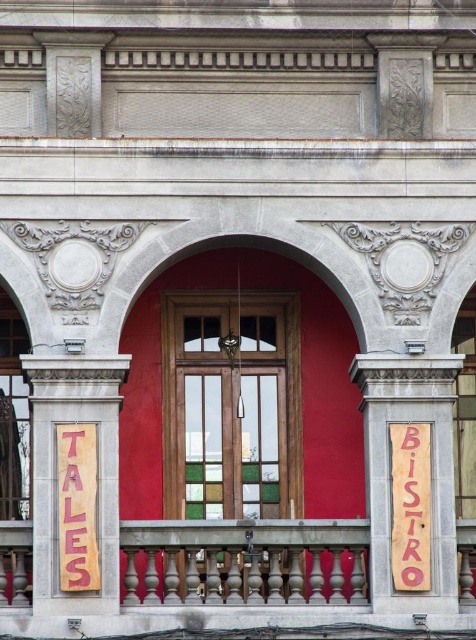
Is smooth gray balustrade at center to the left of wooden sign at center from the viewer's perspective?

Correct, you'll find smooth gray balustrade at center to the left of wooden sign at center.

Which is above, smooth gray balustrade at center or wooden sign at center?

wooden sign at center

Where is `smooth gray balustrade at center`? smooth gray balustrade at center is located at coordinates (245, 561).

Image resolution: width=476 pixels, height=640 pixels. What do you see at coordinates (245, 561) in the screenshot? I see `smooth gray balustrade at center` at bounding box center [245, 561].

Can you confirm if smooth gray balustrade at center is smaller than wooden sign at right?

No.

Is point (358, 586) less distant than point (373, 413)?

Yes.

In order to click on smooth gray balustrade at center in this screenshot , I will do `click(245, 561)`.

Can you confirm if smooth gray balustrade at center is bigger than pink cardboard sign at center?

No.

Which is in front, point (365, 520) or point (62, 486)?

Positioned in front is point (62, 486).

You are a GUI agent. You are given a task and a screenshot of the screen. Output one action in this format:
    pyautogui.click(x=<x>, y=<y>)
    Task: Click on the smooth gray balustrade at center
    
    Given the screenshot: What is the action you would take?
    pyautogui.click(x=245, y=561)